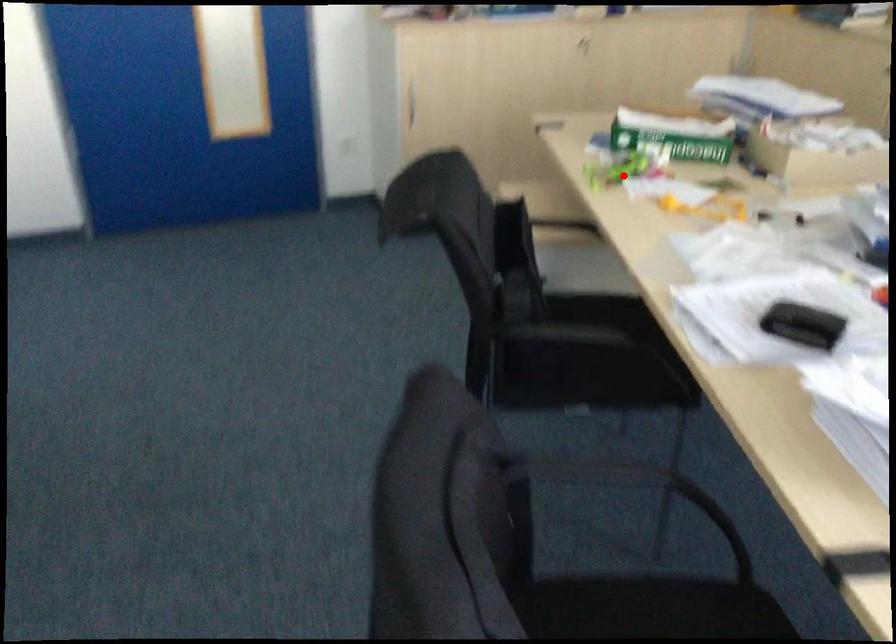
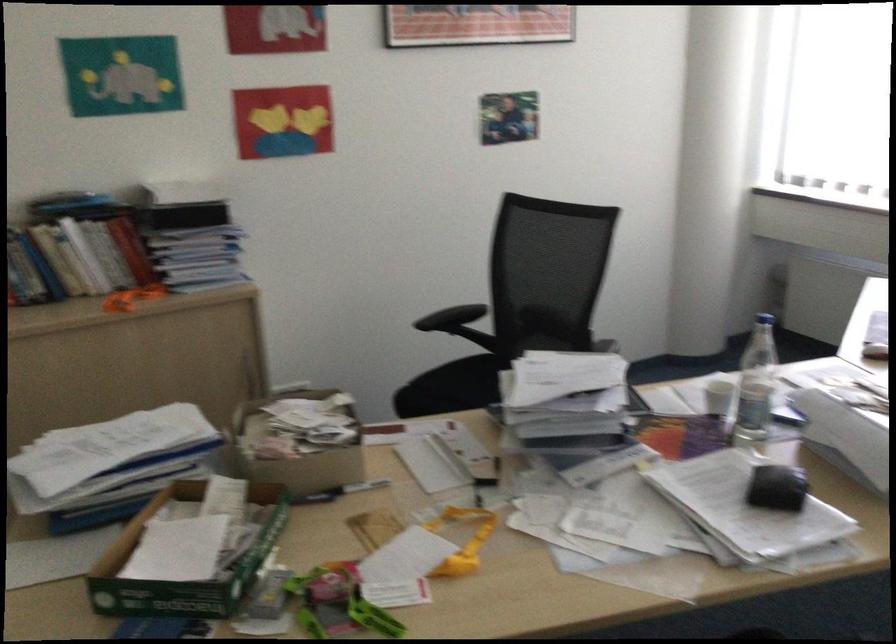
Locate, in the second image, the point that corresponds to the highlighted location in the first image.

(345, 603)